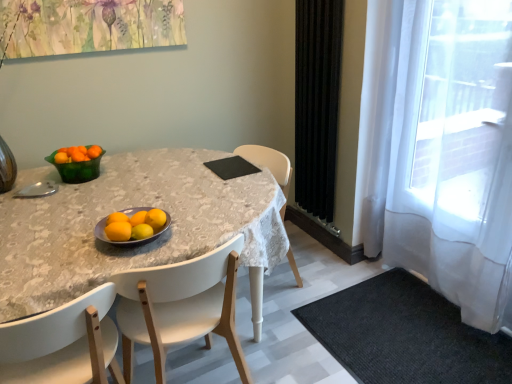
Locate an element on the screen. free spot in front of green glass bowl at upper left, which is counted as the first bowl, starting from the top is located at coordinates (65, 194).